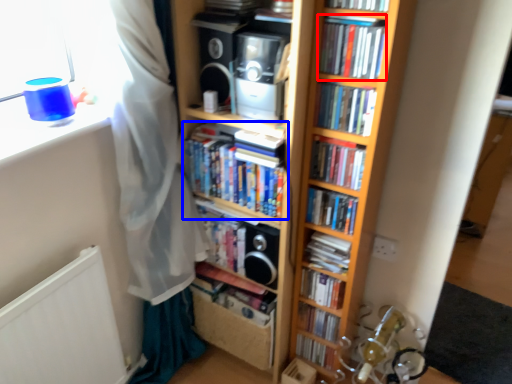
Question: Among these objects, which one is nearest to the camera, book (highlighted by a red box) or book (highlighted by a blue box)?

Choices:
 (A) book
 (B) book

Answer: (A)